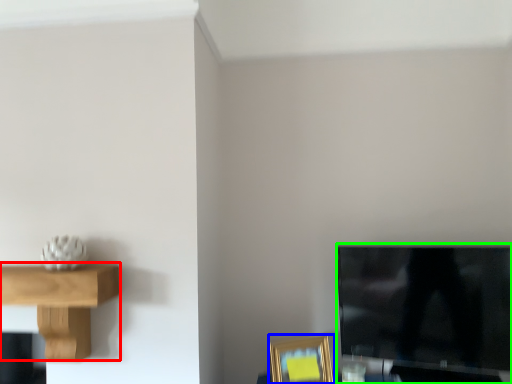
Question: Estimate the real-world distances between objects in this image. Which object is closer to shelf (highlighted by a red box), picture frame (highlighted by a blue box) or television (highlighted by a green box)?

Choices:
 (A) picture frame
 (B) television

Answer: (A)